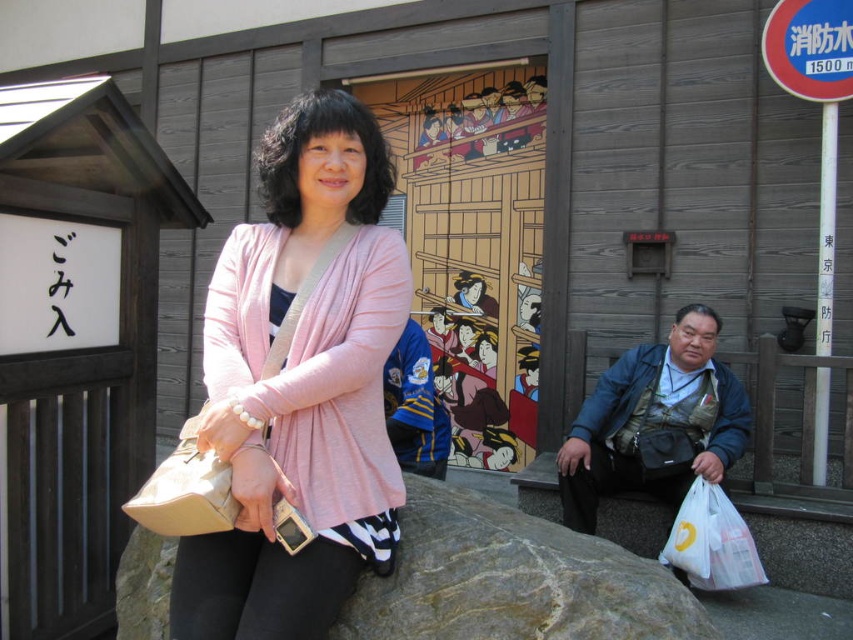
Does pink fabric sweater at center appear on the left side of beige fabric bag at center?

Incorrect, pink fabric sweater at center is not on the left side of beige fabric bag at center.

Is point (204, 326) farther from viewer compared to point (206, 512)?

Yes, it is behind point (206, 512).

Find the location of a particular element. The width and height of the screenshot is (853, 640). pink fabric sweater at center is located at coordinates (300, 385).

Can you confirm if gray rough stone at center is bigger than white plastic bag at lower right?

Yes.

Is point (129, 545) closer to viewer compared to point (679, 518)?

Yes, point (129, 545) is in front of point (679, 518).

Where is `gray rough stone at center`? Image resolution: width=853 pixels, height=640 pixels. gray rough stone at center is located at coordinates (512, 579).

Does beige fabric bag at center have a greater height compared to white plastic bag at lower right?

In fact, beige fabric bag at center may be shorter than white plastic bag at lower right.

Between beige fabric bag at center and white plastic bag at lower right, which one has more height?

Standing taller between the two is white plastic bag at lower right.

Which is behind, point (229, 529) or point (694, 540)?

Point (694, 540)

Locate an element on the screen. The width and height of the screenshot is (853, 640). beige fabric bag at center is located at coordinates (186, 490).